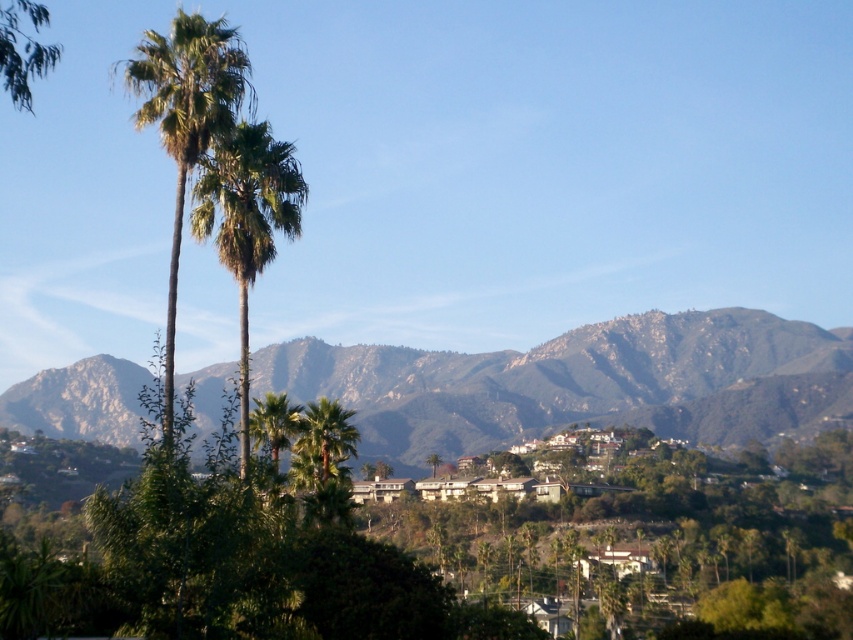
Question: Considering the real-world distances, which object is farthest from the green leafy palm tree at center?

Choices:
 (A) green rocky mountain range at center
 (B) green leafy palm at left

Answer: (A)

Question: Can you confirm if green rocky mountain range at center is bigger than green leafy palm at left?

Choices:
 (A) yes
 (B) no

Answer: (A)

Question: Does green rocky mountain range at center appear on the right side of green leafy palm at left?

Choices:
 (A) no
 (B) yes

Answer: (B)

Question: Is green rocky mountain range at center thinner than green leafy palm tree at center?

Choices:
 (A) no
 (B) yes

Answer: (A)

Question: Which object is positioned farthest from the green leafy palm at left?

Choices:
 (A) green rocky mountain range at center
 (B) green leafy palm tree at center

Answer: (A)

Question: Which point is closer to the camera?

Choices:
 (A) green leafy palm tree at center
 (B) green leafy palm at left
 (C) green rocky mountain range at center

Answer: (B)